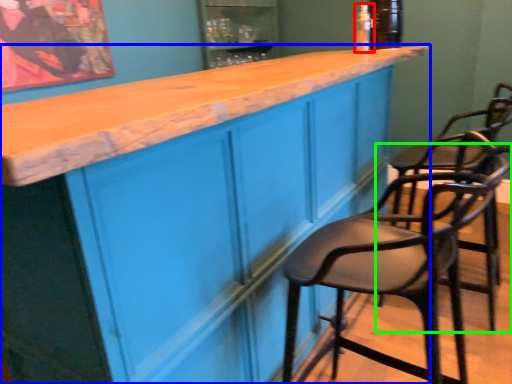
Question: Which object is positioned farthest from bottle (highlighted by a red box)? Select from cabinetry (highlighted by a blue box) and chair (highlighted by a green box).

Choices:
 (A) cabinetry
 (B) chair

Answer: (B)